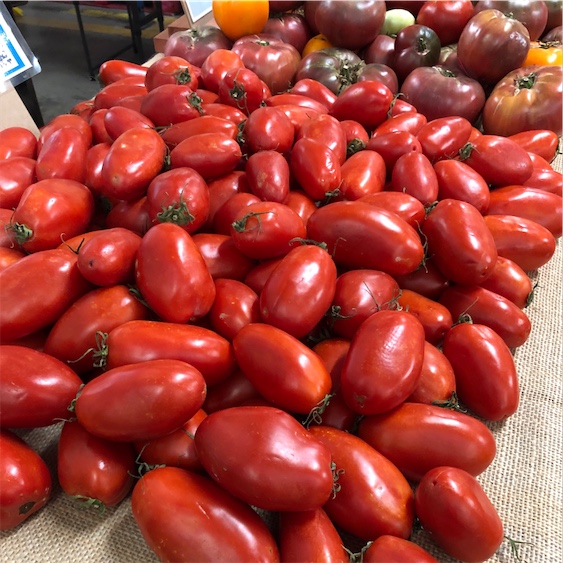
Locate an element on the screen. The height and width of the screenshot is (563, 563). background table legs is located at coordinates (137, 29), (160, 12), (88, 53).